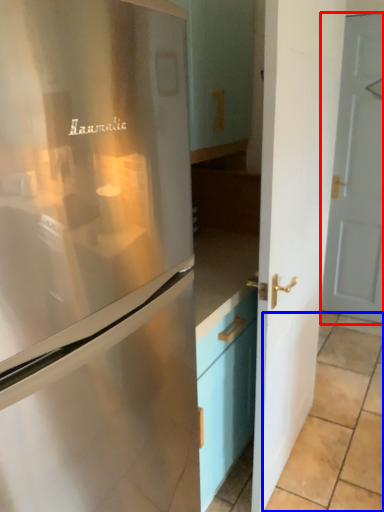
Question: Which object is closer to the camera taking this photo, door (highlighted by a red box) or tile (highlighted by a blue box)?

Choices:
 (A) door
 (B) tile

Answer: (B)